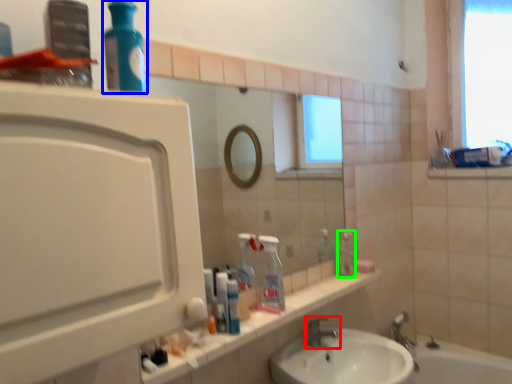
Question: Which object is the farthest from tap (highlighted by a red box)? Choose among these: cleaning product (highlighted by a blue box) or bottle (highlighted by a green box).

Choices:
 (A) cleaning product
 (B) bottle

Answer: (A)